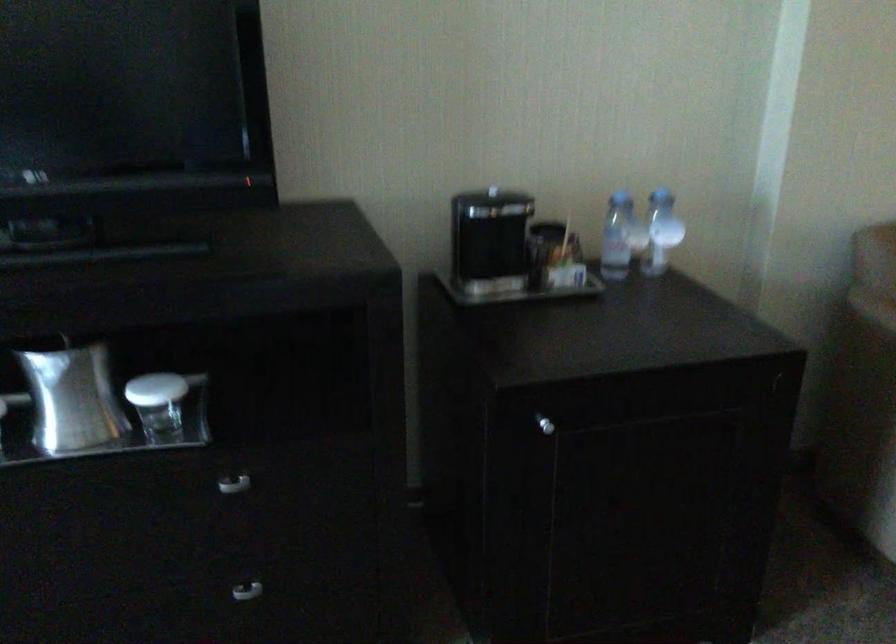
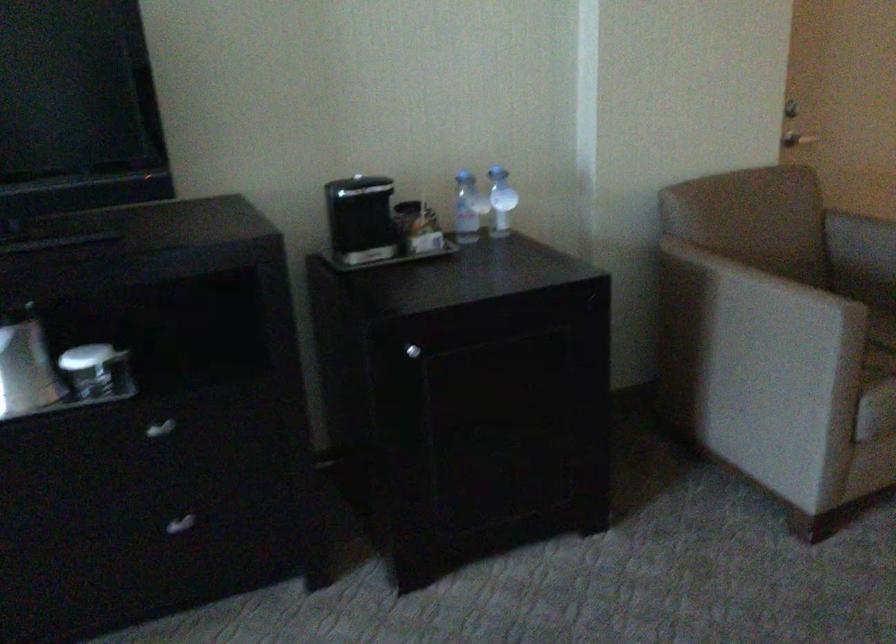
Question: The first image is from the beginning of the video and the second image is from the end. How did the camera likely rotate when shooting the video?

Choices:
 (A) Left
 (B) Right
 (C) Up
 (D) Down

Answer: (B)